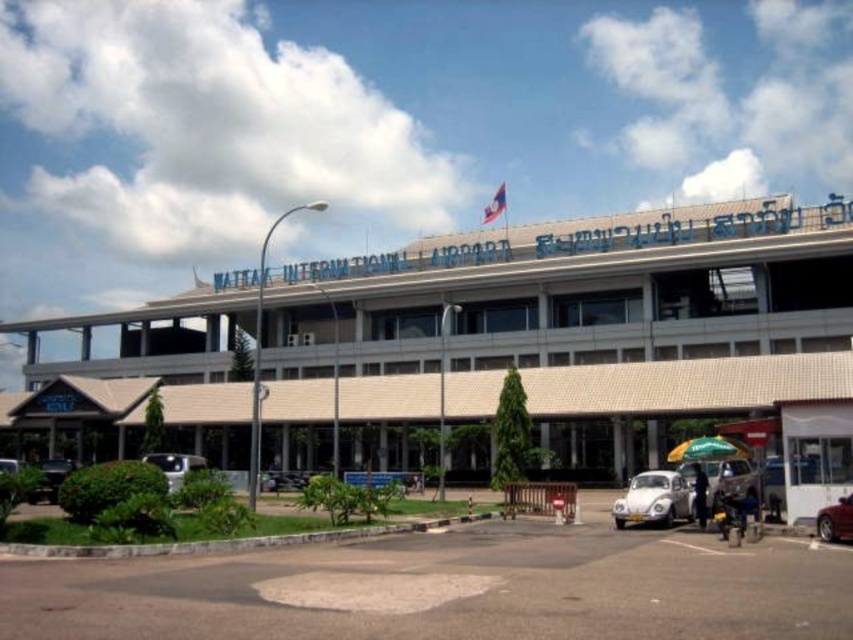
Question: Which point is farther to the camera?

Choices:
 (A) white matte car at lower left
 (B) white matte car at lower center

Answer: (B)

Question: Which of the following is the farthest from the observer?

Choices:
 (A) shiny red car at lower right
 (B) beige textured building at lower left

Answer: (B)

Question: Is beige textured building at lower left further to camera compared to white matte car at lower left?

Choices:
 (A) yes
 (B) no

Answer: (A)

Question: Which point is farther from the camera taking this photo?

Choices:
 (A) (173, 454)
 (B) (688, 497)
 (C) (819, 371)

Answer: (A)

Question: Is beige textured building at lower left above white matte car at lower left?

Choices:
 (A) yes
 (B) no

Answer: (A)

Question: Is beige textured building at lower left further to the viewer compared to white matte car at lower center?

Choices:
 (A) no
 (B) yes

Answer: (A)